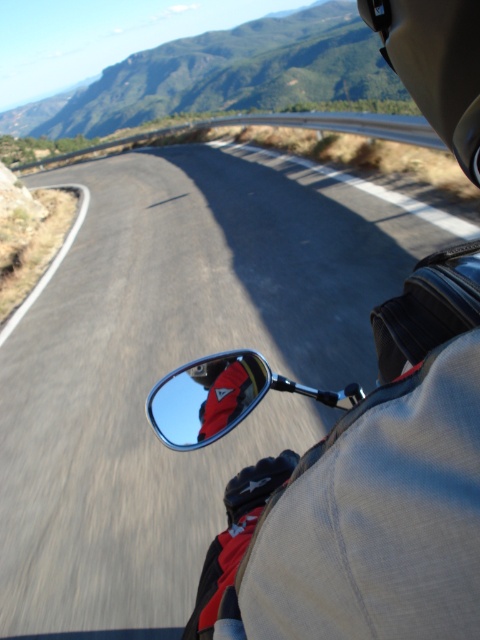
Does polished chrome mirror at lower center appear on the left side of red leather glove at side mirror?

Correct, you'll find polished chrome mirror at lower center to the left of red leather glove at side mirror.

This screenshot has height=640, width=480. I want to click on polished chrome mirror at lower center, so tap(206, 397).